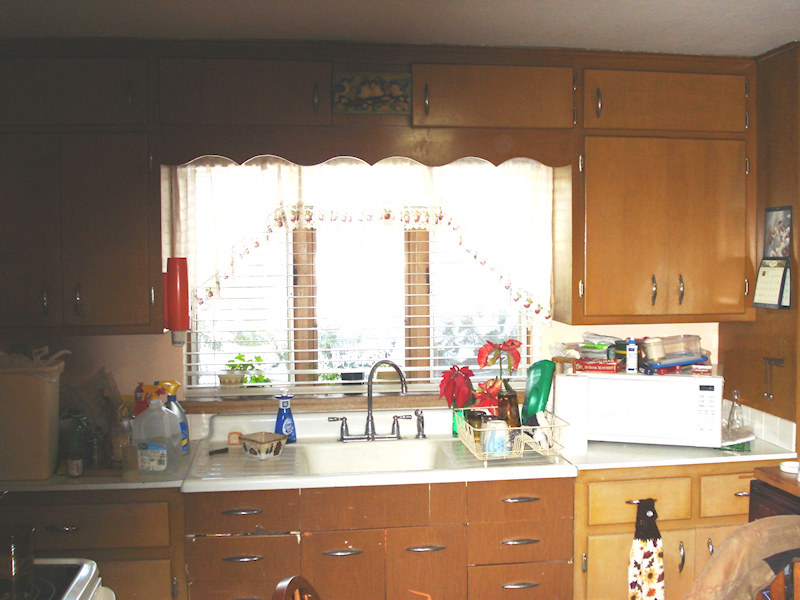
The width and height of the screenshot is (800, 600). In order to click on calendar page in this screenshot , I will do coord(768,285).